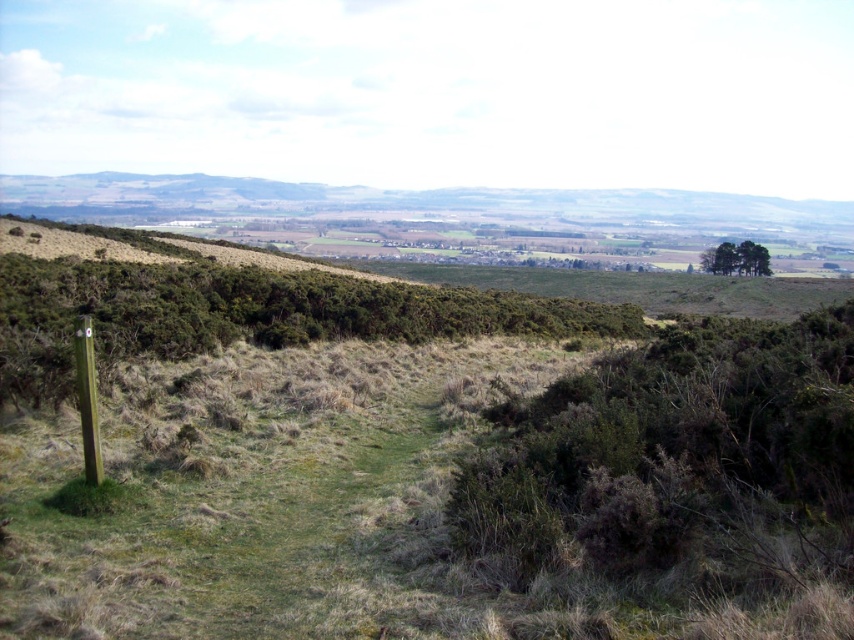
You are a hiker planning to walk from the green leafy shrubs at lower left to the green leafy trees at upper right. Given that your average walking pace is 1.4 meters per second, how many minutes will it take you to reach the trees?

The distance between the green leafy shrubs at lower left and the green leafy trees at upper right is 56.46 meters. At a pace of 1.4 meters per second, the time required would be 56.46 divided by 1.4, which equals approximately 40.33 seconds. Converting this to minutes, it would take roughly 0.67 minutes, so about 0.7 minutes.

Consider the image. You are a hiker carrying a 20 kg backpack and need to navigate between the green leafy shrubs at lower left and the green wooden pole at left. Given that the distance between them is 13.10 meters, can you estimate how many steps it would take to walk from one to the other if each of your steps covers approximately 0.8 meters?

The distance between the green leafy shrubs at lower left and the green wooden pole at left is 13.10 meters. If each step covers 0.8 meters, dividing 13.10 by 0.8 gives approximately 16.375 steps. Since you can only take whole steps, it would take about 16 to 17 steps to walk between them.